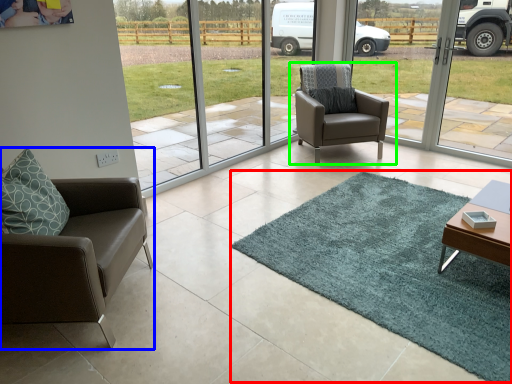
Question: Estimate the real-world distances between objects in this image. Which object is closer to mat (highlighted by a red box), chair (highlighted by a blue box) or chair (highlighted by a green box)?

Choices:
 (A) chair
 (B) chair

Answer: (A)